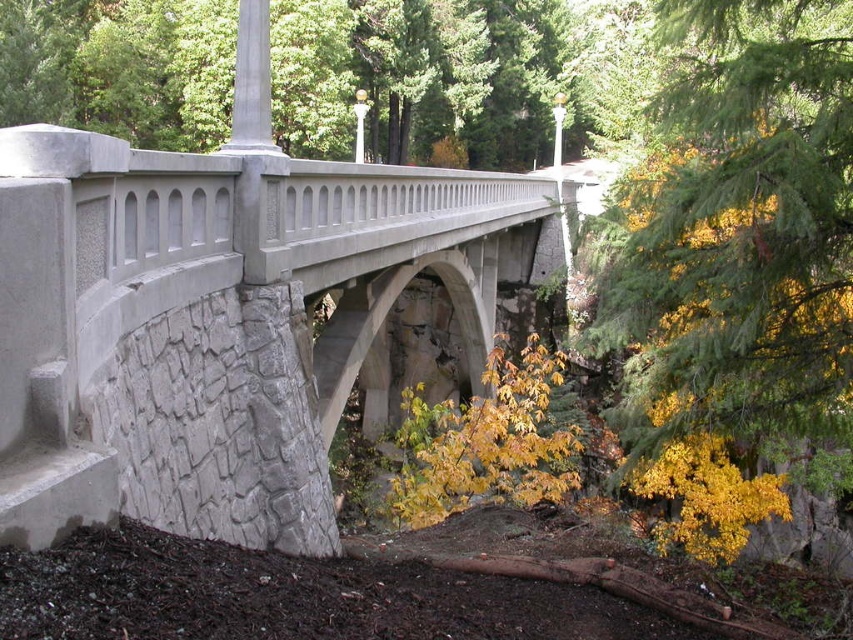
Can you confirm if smooth concrete bridge at center is taller than yellow-green foliage at right?

No, smooth concrete bridge at center is not taller than yellow-green foliage at right.

Which is more to the right, smooth concrete bridge at center or yellow-green foliage at right?

yellow-green foliage at right

Does point (117, 300) come in front of point (672, 136)?

Yes, it is in front of point (672, 136).

I want to click on smooth concrete bridge at center, so click(x=213, y=323).